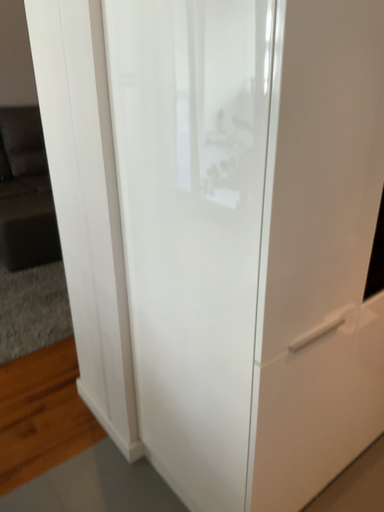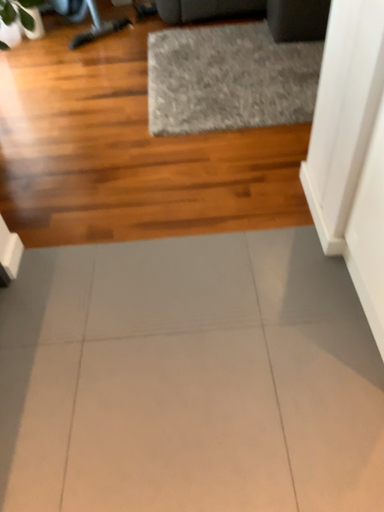
Question: How did the camera likely rotate when shooting the video?

Choices:
 (A) rotated right
 (B) rotated left

Answer: (B)